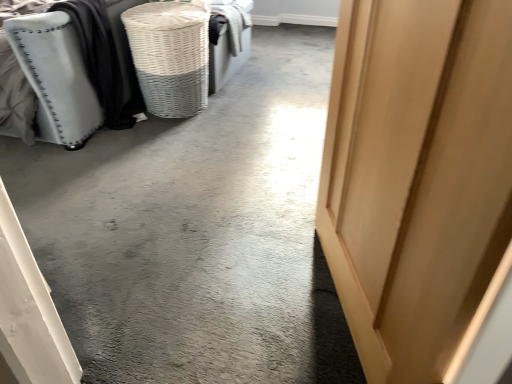
Question: Is matte gray fabric ottoman at left directly adjacent to light wood door at center right?

Choices:
 (A) yes
 (B) no

Answer: (B)

Question: From the image's perspective, would you say matte gray fabric ottoman at left is shown under light wood door at center right?

Choices:
 (A) yes
 (B) no

Answer: (B)

Question: Is matte gray fabric ottoman at left bigger than light wood door at center right?

Choices:
 (A) yes
 (B) no

Answer: (A)

Question: Is matte gray fabric ottoman at left behind light wood door at center right?

Choices:
 (A) no
 (B) yes

Answer: (B)

Question: Considering the relative sizes of matte gray fabric ottoman at left and light wood door at center right in the image provided, is matte gray fabric ottoman at left taller than light wood door at center right?

Choices:
 (A) yes
 (B) no

Answer: (B)

Question: Does matte gray fabric ottoman at left turn towards light wood door at center right?

Choices:
 (A) yes
 (B) no

Answer: (B)

Question: Considering the relative sizes of white wicker basket at upper left and matte gray fabric ottoman at left in the image provided, is white wicker basket at upper left wider than matte gray fabric ottoman at left?

Choices:
 (A) yes
 (B) no

Answer: (B)

Question: Is the position of white wicker basket at upper left more distant than that of matte gray fabric ottoman at left?

Choices:
 (A) no
 (B) yes

Answer: (B)

Question: Is white wicker basket at upper left at the left side of matte gray fabric ottoman at left?

Choices:
 (A) yes
 (B) no

Answer: (B)

Question: Can you confirm if white wicker basket at upper left is thinner than matte gray fabric ottoman at left?

Choices:
 (A) no
 (B) yes

Answer: (B)

Question: Is white wicker basket at upper left smaller than matte gray fabric ottoman at left?

Choices:
 (A) no
 (B) yes

Answer: (B)

Question: From a real-world perspective, is white wicker basket at upper left located higher than matte gray fabric ottoman at left?

Choices:
 (A) yes
 (B) no

Answer: (B)

Question: Considering the relative sizes of white wicker basket at upper left and light wood door at center right in the image provided, is white wicker basket at upper left smaller than light wood door at center right?

Choices:
 (A) no
 (B) yes

Answer: (B)